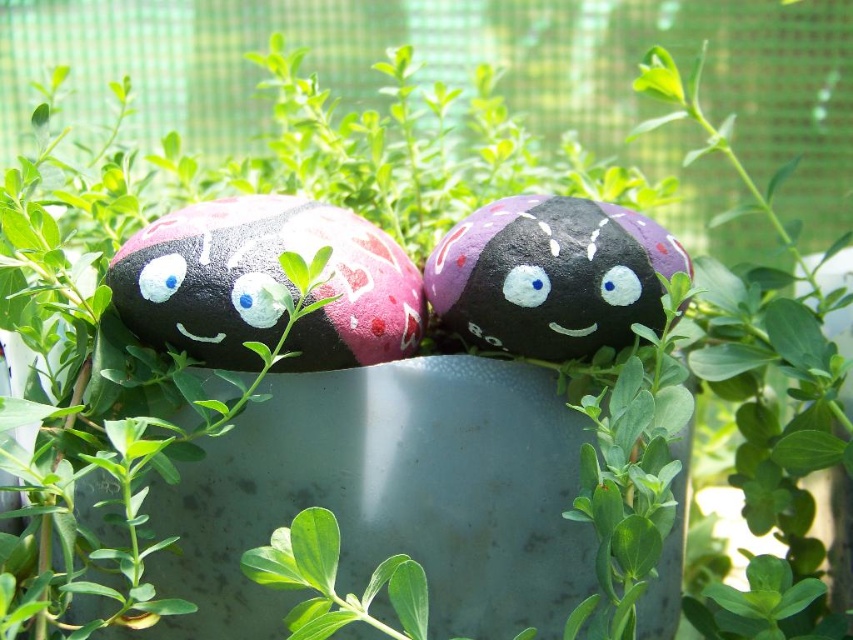
Who is positioned more to the right, matte pink rock at center or matte white eye at center?

matte white eye at center is more to the right.

Can you confirm if matte pink rock at center is smaller than matte white eye at center?

Actually, matte pink rock at center might be larger than matte white eye at center.

This screenshot has height=640, width=853. I want to click on matte pink rock at center, so click(263, 280).

Who is more forward, (821, 561) or (512, 298)?

Point (512, 298)

Identify the location of green leafy plant at center. pos(762,397).

Can you confirm if matte pink rock at center is smaller than white matte eye at center?

No.

Between matte pink rock at center and white matte eye at center, which one is positioned lower?

white matte eye at center is below.

Where is `matte pink rock at center`? matte pink rock at center is located at coordinates (263, 280).